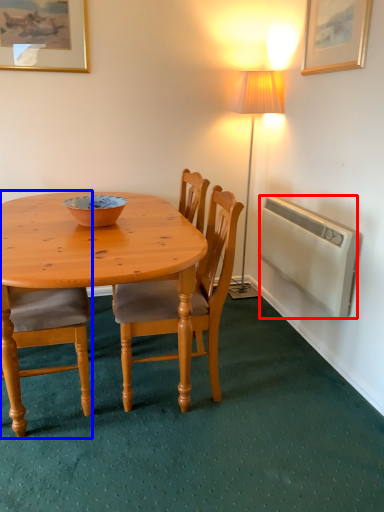
Question: Which object is closer to the camera taking this photo, radiator (highlighted by a red box) or chair (highlighted by a blue box)?

Choices:
 (A) radiator
 (B) chair

Answer: (B)